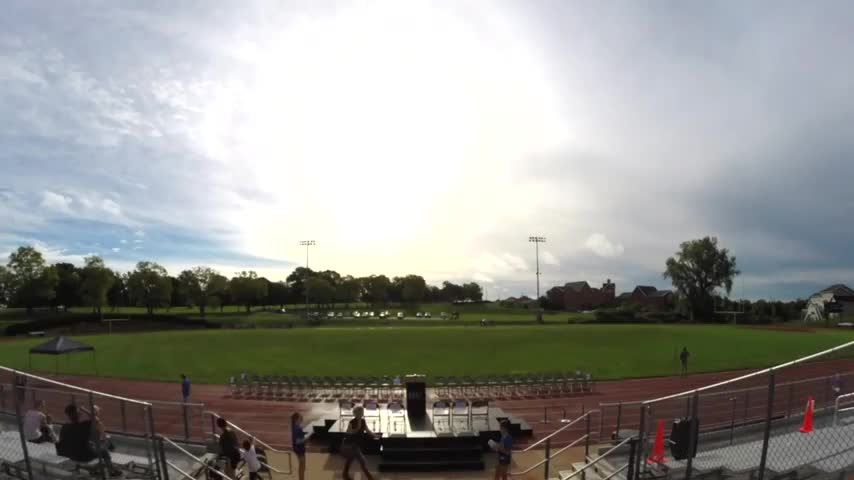
The height and width of the screenshot is (480, 854). Find the location of `stairs`. stairs is located at coordinates (562, 472), (577, 464), (594, 458), (208, 478).